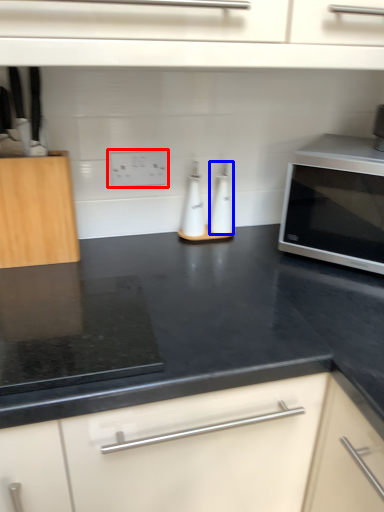
Question: Among these objects, which one is nearest to the camera, electric outlet (highlighted by a red box) or bottle (highlighted by a blue box)?

Choices:
 (A) electric outlet
 (B) bottle

Answer: (A)